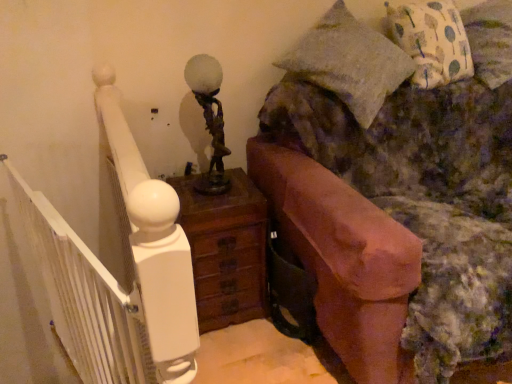
Question: From the image's perspective, is printed fabric pillow at upper right located above terracotta clay fireplace at right?

Choices:
 (A) yes
 (B) no

Answer: (A)

Question: Is printed fabric pillow at upper right positioned with its back to terracotta clay fireplace at right?

Choices:
 (A) yes
 (B) no

Answer: (B)

Question: Does printed fabric pillow at upper right have a lesser width compared to terracotta clay fireplace at right?

Choices:
 (A) yes
 (B) no

Answer: (A)

Question: Considering the relative positions of printed fabric pillow at upper right and terracotta clay fireplace at right in the image provided, is printed fabric pillow at upper right to the right of terracotta clay fireplace at right from the viewer's perspective?

Choices:
 (A) yes
 (B) no

Answer: (A)

Question: Is printed fabric pillow at upper right outside terracotta clay fireplace at right?

Choices:
 (A) yes
 (B) no

Answer: (B)

Question: Considering the relative positions of printed fabric pillow at upper right and terracotta clay fireplace at right in the image provided, is printed fabric pillow at upper right in front of terracotta clay fireplace at right?

Choices:
 (A) yes
 (B) no

Answer: (B)

Question: Does printed fabric pillow at upper right have a greater width compared to white painted wood balustrade at left?

Choices:
 (A) no
 (B) yes

Answer: (B)

Question: Considering the relative sizes of printed fabric pillow at upper right and white painted wood balustrade at left in the image provided, is printed fabric pillow at upper right smaller than white painted wood balustrade at left?

Choices:
 (A) no
 (B) yes

Answer: (B)

Question: Does printed fabric pillow at upper right touch white painted wood balustrade at left?

Choices:
 (A) no
 (B) yes

Answer: (A)

Question: Does printed fabric pillow at upper right appear on the right side of white painted wood balustrade at left?

Choices:
 (A) yes
 (B) no

Answer: (A)

Question: Is printed fabric pillow at upper right facing towards white painted wood balustrade at left?

Choices:
 (A) no
 (B) yes

Answer: (A)

Question: Is printed fabric pillow at upper right far from white painted wood balustrade at left?

Choices:
 (A) no
 (B) yes

Answer: (B)

Question: Are terracotta clay fireplace at right and brown wooden nightstand at center located far from each other?

Choices:
 (A) no
 (B) yes

Answer: (A)